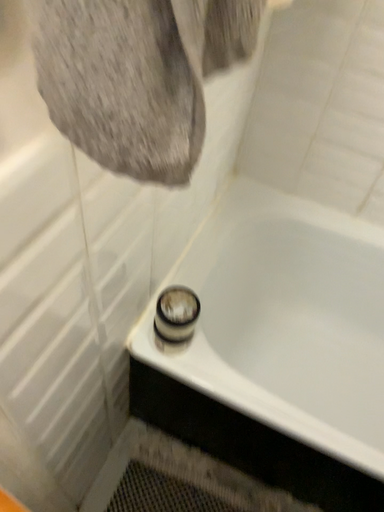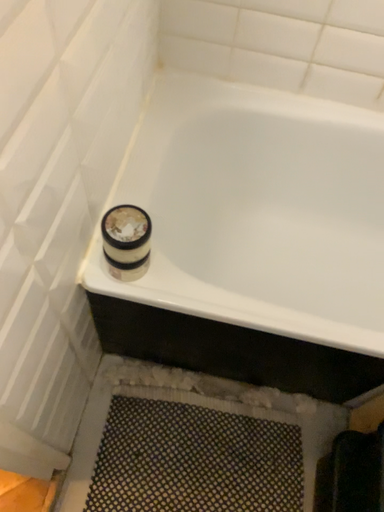
Question: Which way did the camera rotate in the video?

Choices:
 (A) rotated right
 (B) rotated left

Answer: (A)